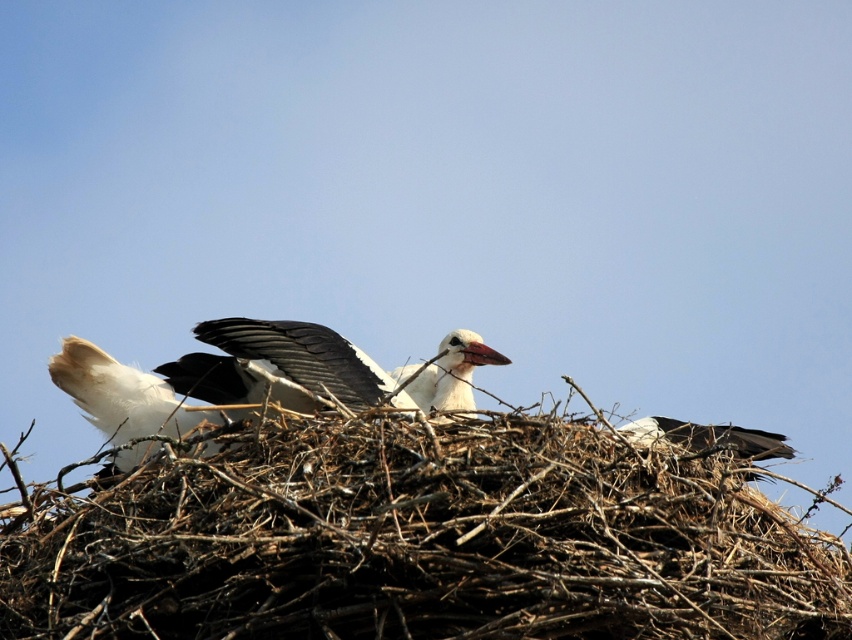
How far apart are the two storks in the brown twigs nest at center?

The two storks in the brown twigs nest at center are 3.80 meters apart.

You are a birdwatcher observing the brown twigs nest at center and the white matte bird at center. Which object is located to the left of the other?

The white matte bird at center is located to the left of the brown twigs nest at center because the brown twigs nest at center is positioned on the right side of the white matte bird at center.

You are a birdwatcher standing 6 feet tall. You want to take a photo of the nest and the storks. If you position yourself so that your eyes are at the point marked at coordinates point [361,545], will your head block the view of the storks in the nest?

The point marked at coordinates point [361,545] is 13.18 feet from the camera. Since you are 6 feet tall, your head would be approximately 6 feet above the ground. However, the distance from the camera to the point is 13.18 feet, which means the point is farther away than your height. Therefore, positioning your eyes at that point would not block the view of the storks in the nest because the point is at a sufficient distance from the camera.